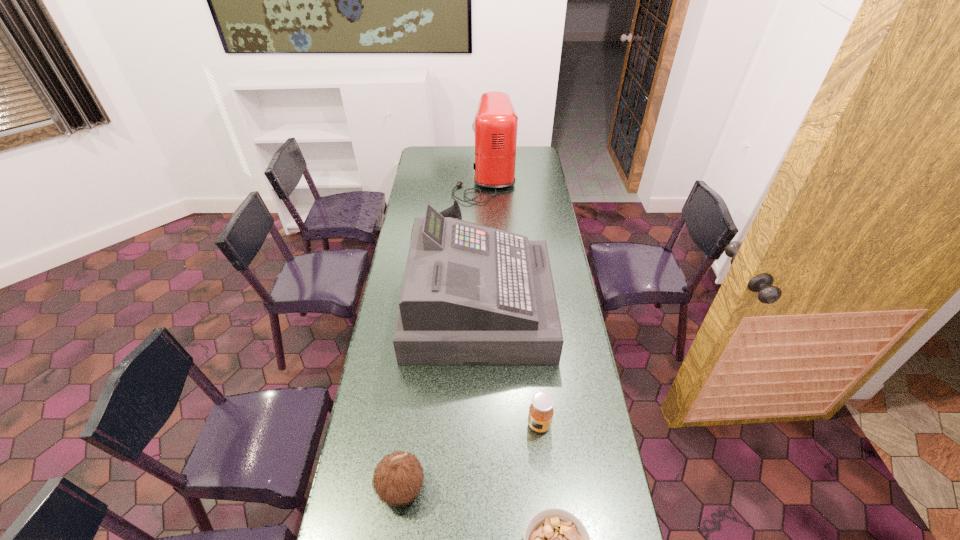
Find the location of a particular element. The width and height of the screenshot is (960, 540). kitchen mixer is located at coordinates (495, 127).

The image size is (960, 540). What are the coordinates of `cash register` in the screenshot? It's located at (472, 295).

Locate an element on the screen. Image resolution: width=960 pixels, height=540 pixels. coconut is located at coordinates (398, 478).

The image size is (960, 540). Find the location of `phonograph_record`. phonograph_record is located at coordinates (454, 211).

Image resolution: width=960 pixels, height=540 pixels. Find the location of `the fourth tallest object`. the fourth tallest object is located at coordinates (454, 211).

This screenshot has height=540, width=960. I want to click on the second shortest object, so click(x=541, y=411).

Locate an element on the screen. This screenshot has height=540, width=960. the fourth farthest object is located at coordinates (x=541, y=411).

Find the location of a particular element. vacant position located 0.060m on the front-facing side of the kitchen mixer is located at coordinates (443, 178).

Find the location of `vacant space located on the front-facing side of the cash register`. vacant space located on the front-facing side of the cash register is located at coordinates (575, 308).

The width and height of the screenshot is (960, 540). In order to click on vacant area situated from the horn of the second farthest object in this screenshot , I will do pos(490,233).